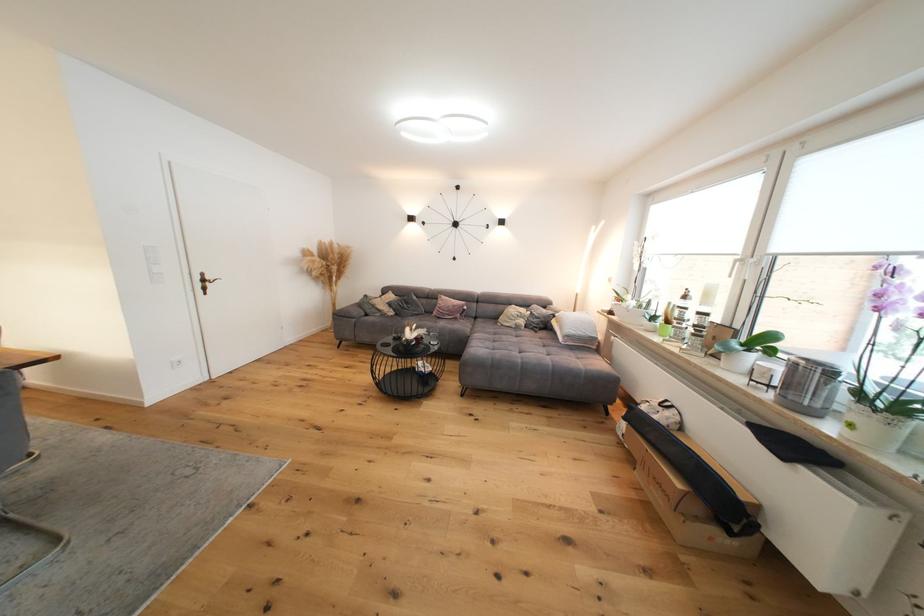
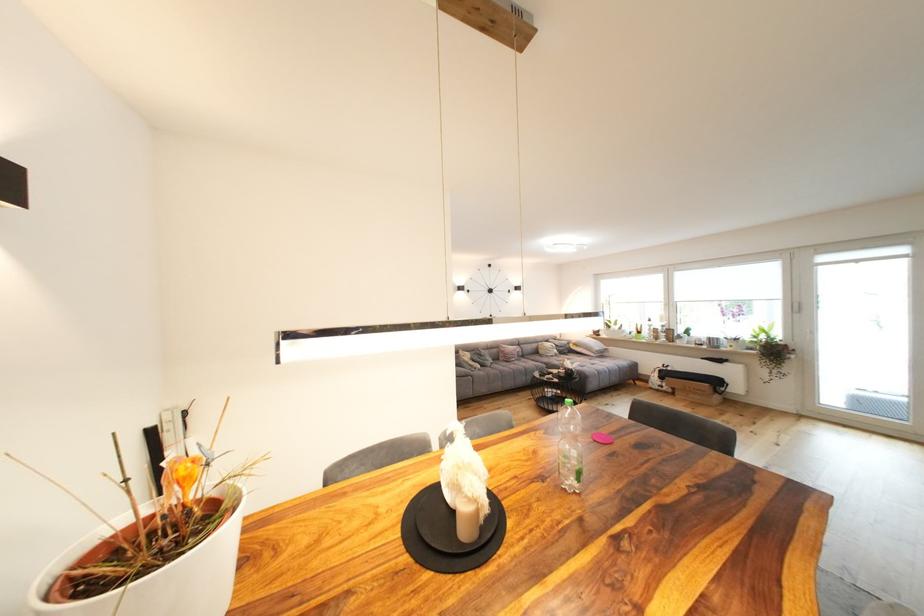
In the second image, find the point that corresponds to (396,306) in the first image.

(480, 361)